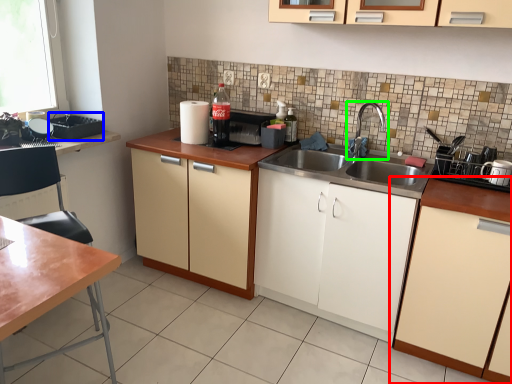
Question: Considering the real-world distances, which object is farthest from cabinetry (highlighted by a red box)? appliance (highlighted by a blue box) or tap (highlighted by a green box)?

Choices:
 (A) appliance
 (B) tap

Answer: (A)